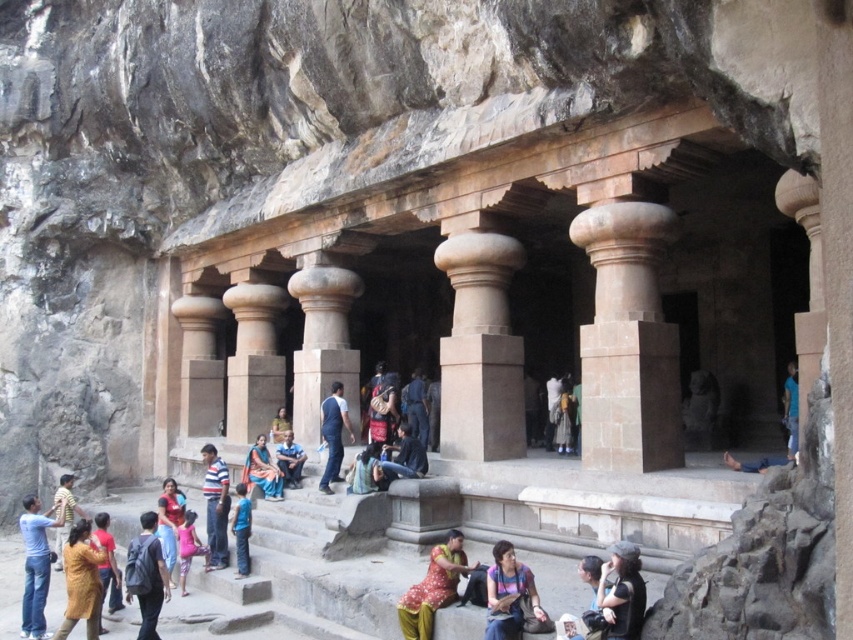
Does smooth stone column at center have a lesser height compared to matte pink shirt at lower center?

In fact, smooth stone column at center may be taller than matte pink shirt at lower center.

Where is `smooth stone column at center`? This screenshot has width=853, height=640. smooth stone column at center is located at coordinates (323, 344).

Between point (309, 353) and point (491, 586), which one is positioned in front?

Positioned in front is point (491, 586).

Where is `smooth stone column at center`? This screenshot has width=853, height=640. smooth stone column at center is located at coordinates (323, 344).

Measure the distance between dotted fabric dress at center and camera.

The distance of dotted fabric dress at center from camera is 142.19 feet.

Is point (448, 598) farther from camera compared to point (178, 552)?

No, it is in front of (178, 552).

The height and width of the screenshot is (640, 853). I want to click on dotted fabric dress at center, so click(x=433, y=588).

Which is more to the left, brown stone column at center or pink fabric dress at lower center?

pink fabric dress at lower center is more to the left.

Is brown stone column at center to the right of pink fabric dress at lower center from the viewer's perspective?

Correct, you'll find brown stone column at center to the right of pink fabric dress at lower center.

Does point (675, 442) come behind point (181, 540)?

No, (675, 442) is closer to viewer.

The image size is (853, 640). In order to click on brown stone column at center in this screenshot , I will do `click(628, 340)`.